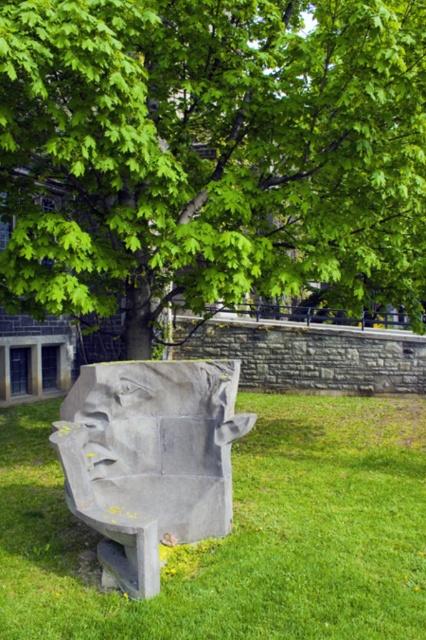
Which is in front, point (313, 506) or point (109, 404)?

Point (109, 404) is more forward.

Does green grass at center have a greater height compared to gray stone sculpture at center?

Incorrect, green grass at center's height is not larger of gray stone sculpture at center's.

Is point (88, 595) closer to camera compared to point (120, 419)?

Yes.

You are a GUI agent. You are given a task and a screenshot of the screen. Output one action in this format:
    pyautogui.click(x=<x>, y=<y>)
    Task: Click on the green grass at center
    Image resolution: width=426 pixels, height=640 pixels.
    Given the screenshot: What is the action you would take?
    pyautogui.click(x=238, y=532)

Can you confirm if green grass at center is smaller than gray stone face at lower left?

Incorrect, green grass at center is not smaller in size than gray stone face at lower left.

Which is below, green grass at center or gray stone face at lower left?

green grass at center is lower down.

At what (x,y) coordinates should I click in order to perform the action: click on green grass at center. Please return your answer as a coordinate pair (x, y). The image size is (426, 640). Looking at the image, I should click on (238, 532).

Between point (412, 16) and point (149, 470), which one is positioned in front?

Point (149, 470) is more forward.

Between green leafy tree at upper center and gray stone sculpture at center, which one appears on the right side from the viewer's perspective?

From the viewer's perspective, green leafy tree at upper center appears more on the right side.

Is point (406, 45) closer to viewer compared to point (155, 387)?

No.

Where is `green leafy tree at upper center`? The height and width of the screenshot is (640, 426). green leafy tree at upper center is located at coordinates (210, 154).